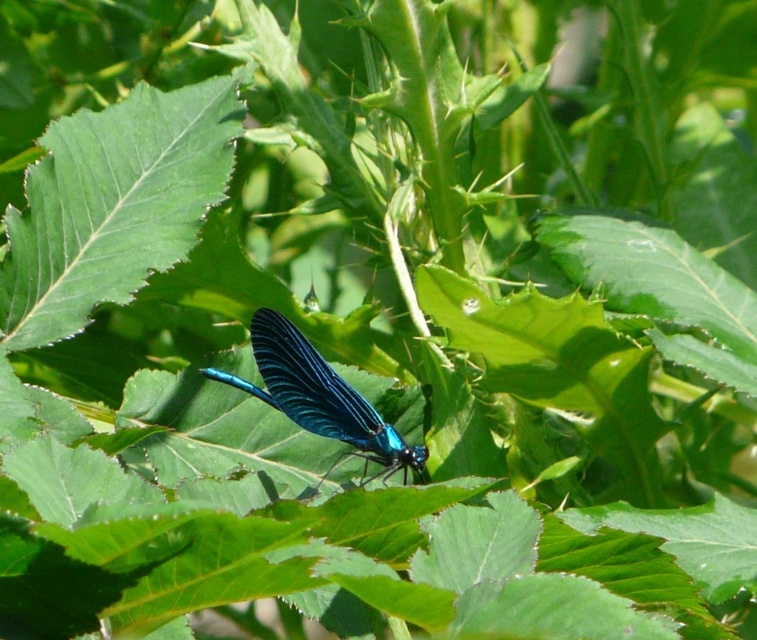
From the picture: You are a photographer trying to capture the dragonfly on the leaf. You notice the green smooth leaf at center and the glossy metallic blue dragonfly at center. Which object is positioned to the left of the other?

The green smooth leaf at center is to the left of the glossy metallic blue dragonfly at center.

You are a researcher studying dragonflies and their perching habits. You observe a dragonfly resting on the green smooth leaf at center. Based on its position at coordinates point 0.320, 0.151, can you determine if this leaf is positioned in the lower half of the image?

The green smooth leaf at center is located at point (114, 204). Since the y coordinate is 0.151, which is less than 0.5, the leaf is in the lower half of the image.